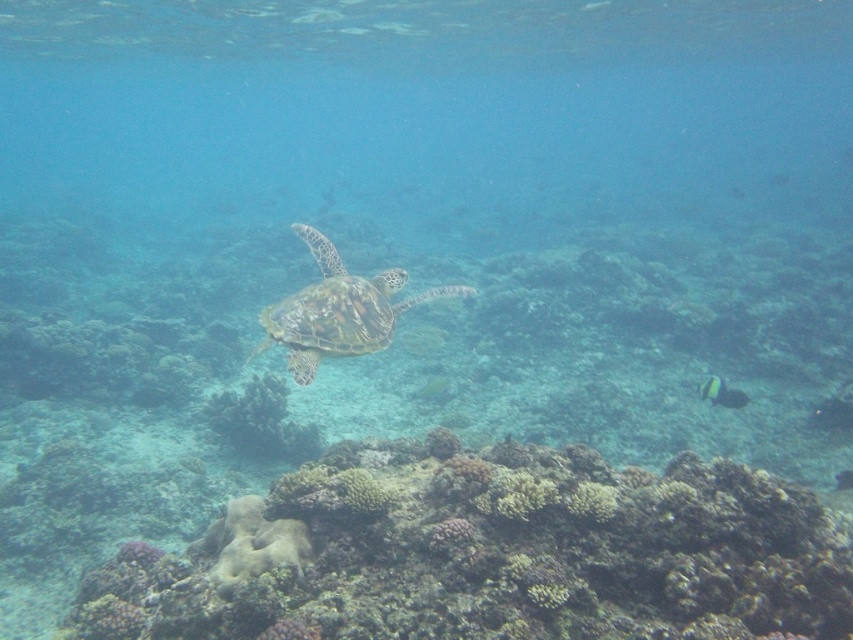
Question: Which of the following is the closest to the observer?

Choices:
 (A) green textured shell at center
 (B) black glossy fish at lower right
 (C) green textured coral at center
 (D) rough textured coral reef at center

Answer: (D)

Question: Is green textured coral at center smaller than black glossy fish at lower right?

Choices:
 (A) yes
 (B) no

Answer: (B)

Question: Which object is the closest to the rough textured coral reef at center?

Choices:
 (A) black glossy fish at lower right
 (B) green textured coral at center
 (C) green textured shell at center

Answer: (C)

Question: Does rough textured coral reef at center appear on the left side of green textured coral at center?

Choices:
 (A) yes
 (B) no

Answer: (B)

Question: Which of the following is the closest to the observer?

Choices:
 (A) black glossy fish at lower right
 (B) green textured shell at center
 (C) rough textured coral reef at center

Answer: (C)

Question: Can you confirm if rough textured coral reef at center is wider than black glossy fish at lower right?

Choices:
 (A) yes
 (B) no

Answer: (A)